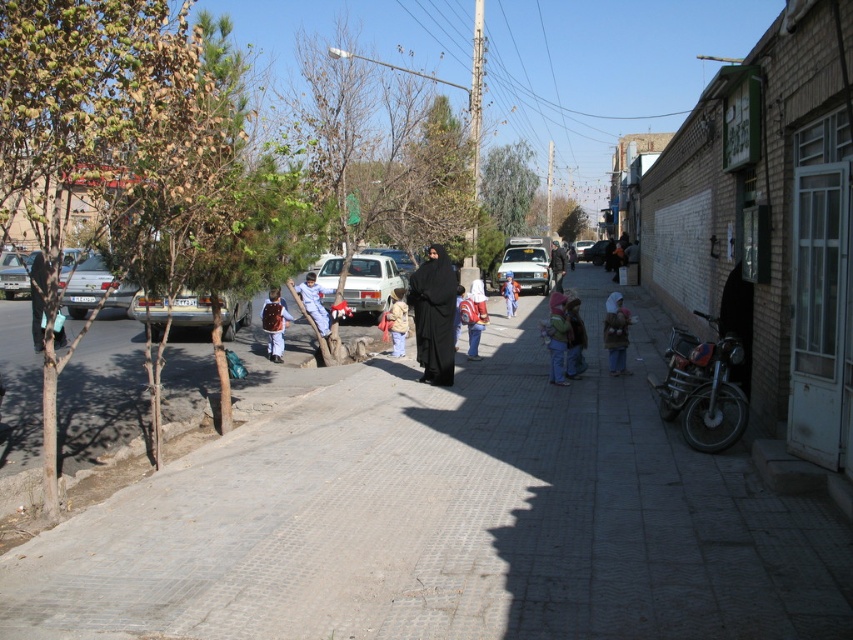
Question: Does black matte hijab at center have a lesser width compared to matte red backpack at center?

Choices:
 (A) yes
 (B) no

Answer: (B)

Question: Which point is farther to the camera?

Choices:
 (A) (248, 300)
 (B) (611, 368)
 (C) (45, 276)
 (D) (376, 301)

Answer: (D)

Question: Does dark metallic motorcycle at right appear over black matte hijab at center?

Choices:
 (A) yes
 (B) no

Answer: (B)

Question: Can you confirm if white matte car at center is thinner than matte red backpack at center?

Choices:
 (A) no
 (B) yes

Answer: (A)

Question: Which of the following is the farthest from the observer?

Choices:
 (A) (461, 321)
 (B) (575, 348)

Answer: (A)

Question: Which point is farther to the camera?

Choices:
 (A) tap(514, 280)
 (B) tap(335, 260)

Answer: (A)